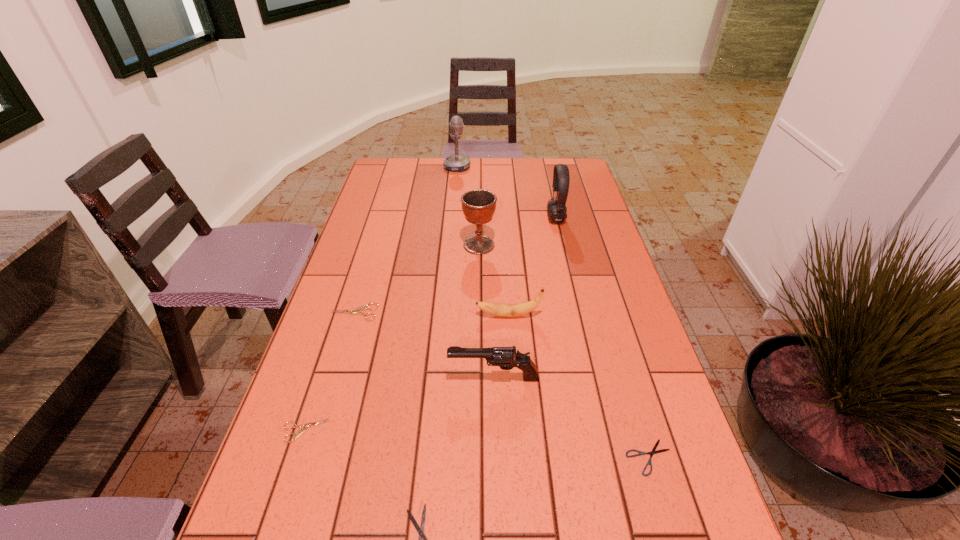
Find the location of a particular element. free space located 0.160m on the peel of the fifth tallest object from the top is located at coordinates (414, 315).

Where is `free spot located 0.240m on the peel of the fifth tallest object from the top`? free spot located 0.240m on the peel of the fifth tallest object from the top is located at coordinates (383, 315).

Find the location of a particular element. The height and width of the screenshot is (540, 960). vacant area located on the peel of the fifth tallest object from the top is located at coordinates (367, 315).

Find the location of a particular element. free space located 0.050m on the right of the fourth shortest object is located at coordinates (396, 312).

Image resolution: width=960 pixels, height=540 pixels. Identify the location of blank space located on the right of the smaller beige shears. (451, 430).

Locate an element on the screen. The width and height of the screenshot is (960, 540). vacant space located on the left of the rightmost shears is located at coordinates (564, 457).

Locate an element on the screen. The height and width of the screenshot is (540, 960). object that is at the far edge is located at coordinates (456, 162).

The height and width of the screenshot is (540, 960). I want to click on headset that is at the right edge, so click(x=557, y=209).

Where is `shears present at the right edge`? shears present at the right edge is located at coordinates (653, 451).

The image size is (960, 540). In order to click on vacant region at the far edge of the desktop in this screenshot , I will do `click(474, 171)`.